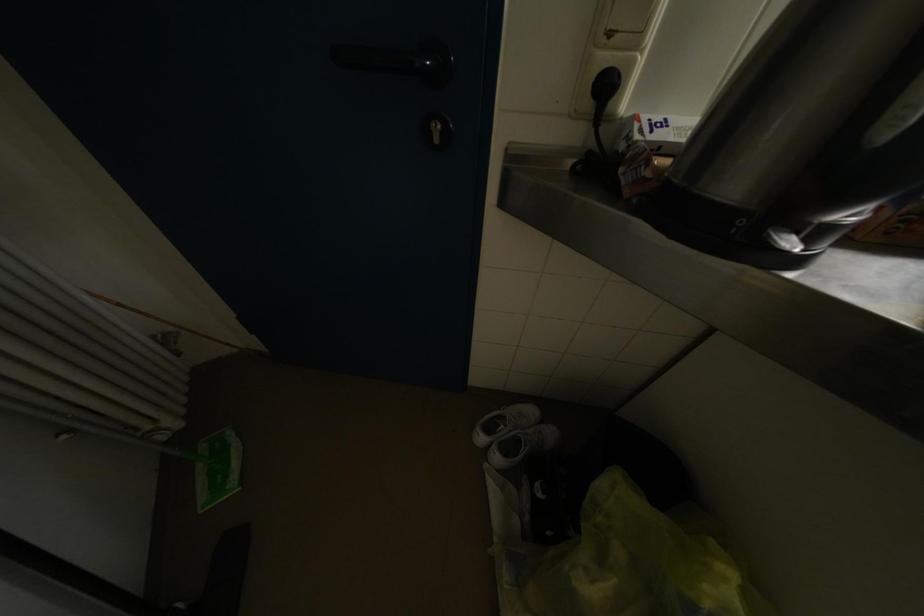
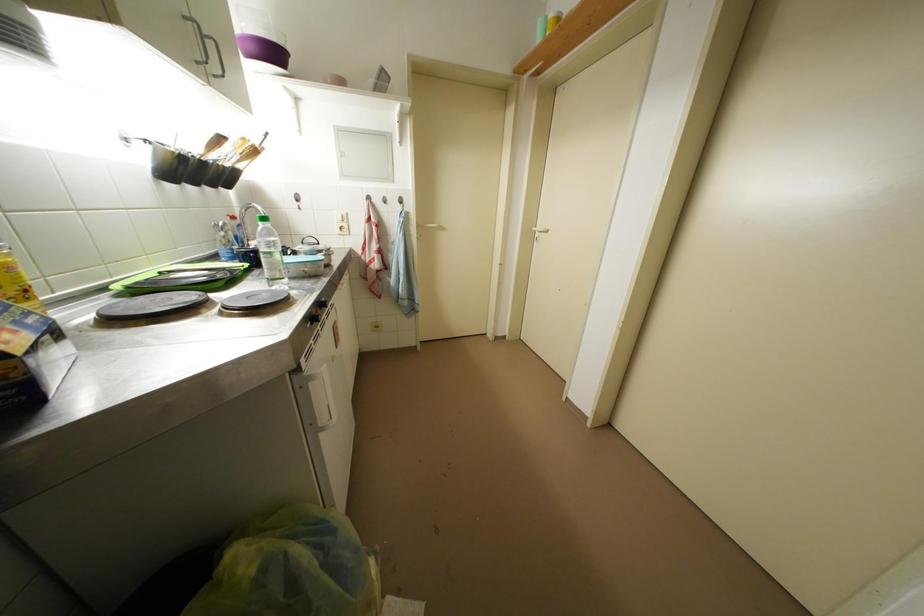
The images are taken continuously from a first-person perspective. In which direction is your viewpoint rotating?

The camera's rotation is toward right-down.